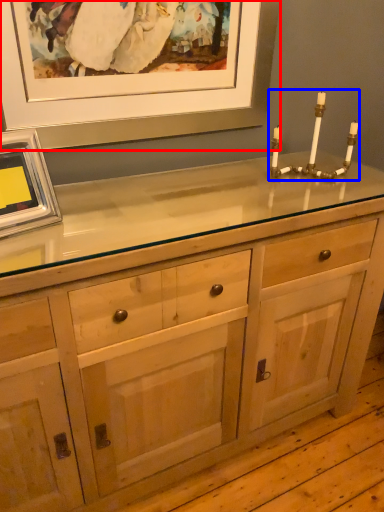
Question: Which of the following is the farthest to the observer, picture frame (highlighted by a red box) or candle holder (highlighted by a blue box)?

Choices:
 (A) picture frame
 (B) candle holder

Answer: (B)